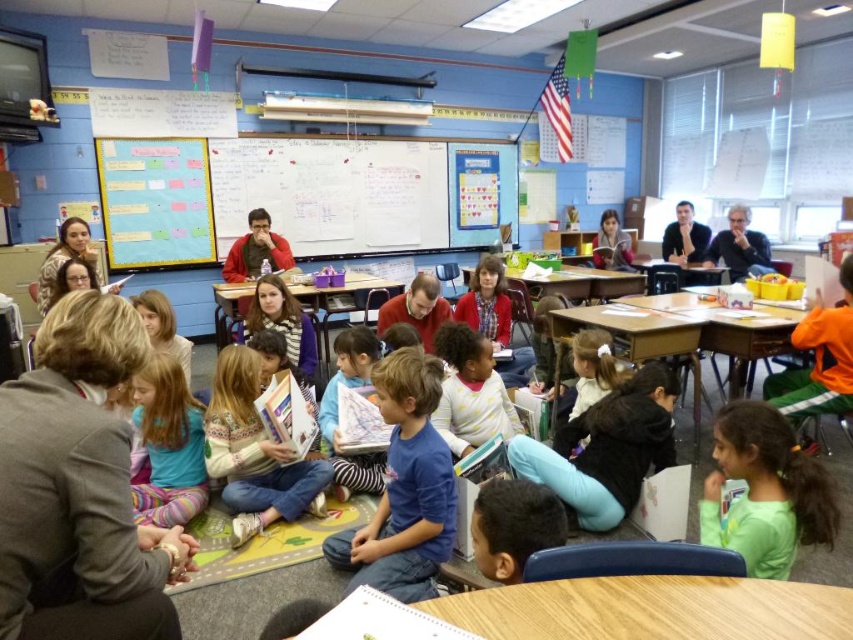
Does gray wool sweater at lower left have a larger size compared to yellow dotted sweater at center?

Actually, gray wool sweater at lower left might be smaller than yellow dotted sweater at center.

Image resolution: width=853 pixels, height=640 pixels. I want to click on gray wool sweater at lower left, so click(79, 488).

Can you confirm if blue cotton shirt at center is positioned to the right of matte black shirt at upper right?

No, blue cotton shirt at center is not to the right of matte black shirt at upper right.

Between point (434, 467) and point (733, 241), which one is positioned behind?

The point (733, 241) is more distant.

Who is more forward, [334,566] or [753,243]?

Point [334,566]

Where is `blue cotton shirt at center`? This screenshot has height=640, width=853. blue cotton shirt at center is located at coordinates (404, 486).

Is knitted sweater at center to the left of pastel striped leggings at lower left from the viewer's perspective?

In fact, knitted sweater at center is to the right of pastel striped leggings at lower left.

What do you see at coordinates (253, 451) in the screenshot? I see `knitted sweater at center` at bounding box center [253, 451].

Describe the element at coordinates (253, 451) in the screenshot. The width and height of the screenshot is (853, 640). I see `knitted sweater at center` at that location.

Where is `knitted sweater at center`? This screenshot has width=853, height=640. knitted sweater at center is located at coordinates [253, 451].